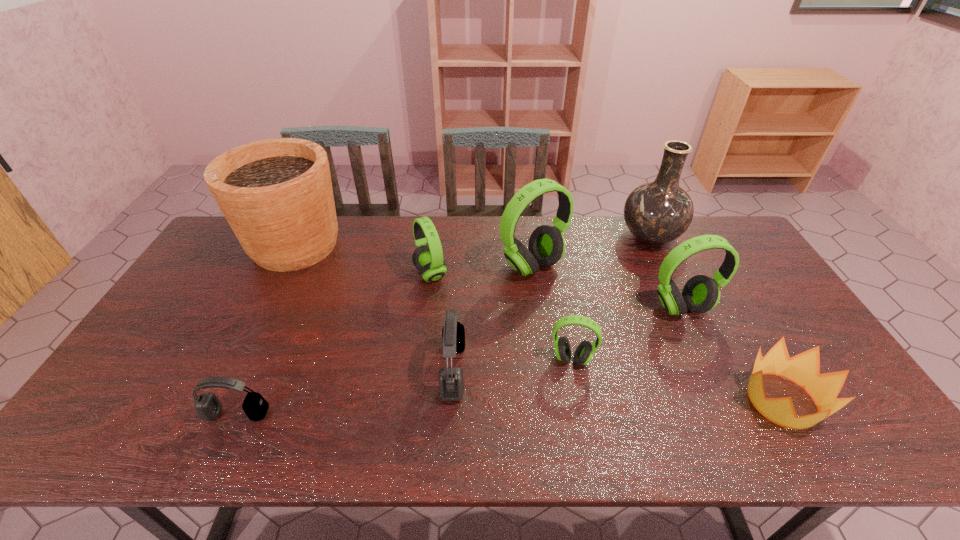
You are a GUI agent. You are given a task and a screenshot of the screen. Output one action in this format:
    pyautogui.click(x=<x>, y=<y>)
    Task: Click on the nearer black headset
    The image size is (960, 540).
    Given the screenshot: What is the action you would take?
    pyautogui.click(x=208, y=407)

Identify the location of the nearest headset. The height and width of the screenshot is (540, 960). 208,407.

Image resolution: width=960 pixels, height=540 pixels. I want to click on gold crown, so click(803, 369).

The image size is (960, 540). What are the coordinates of `vacant position located 0.110m on the right of the vase` in the screenshot? It's located at (712, 238).

In order to click on free region located 0.090m on the front of the flowerpot in this screenshot , I will do `click(269, 299)`.

This screenshot has height=540, width=960. What are the coordinates of `vacant space located 0.200m on the front of the tallest headset` in the screenshot? It's located at (541, 334).

This screenshot has width=960, height=540. In order to click on vacant space located 0.230m on the back of the fourth nearest headset in this screenshot , I will do tap(653, 247).

I want to click on free location located 0.180m on the right of the third biggest green headset, so click(505, 274).

You are a GUI agent. You are given a task and a screenshot of the screen. Output one action in this format:
    pyautogui.click(x=<x>, y=<y>)
    Task: Click on the vacant space located on the headband of the sixth object from right to left
    Image resolution: width=960 pixels, height=540 pixels.
    Given the screenshot: What is the action you would take?
    pyautogui.click(x=484, y=370)

You are a GUI agent. You are given a task and a screenshot of the screen. Output one action in this format:
    pyautogui.click(x=<x>, y=<y>)
    Task: Click on the free spot located on the left of the nearest green headset
    
    Given the screenshot: What is the action you would take?
    pyautogui.click(x=503, y=359)